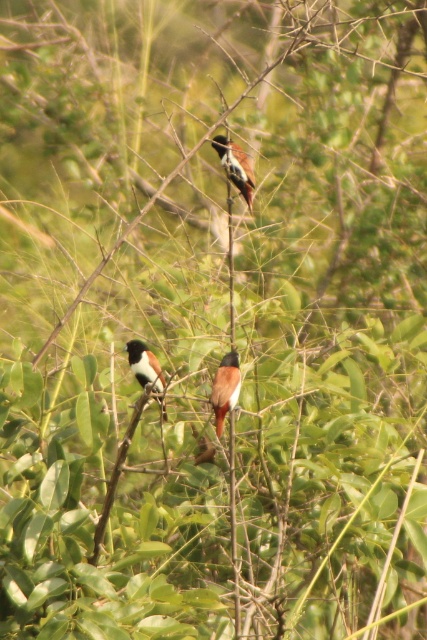
You are observing the birds in the image. There is a brown glossy bird at center and a brown and white feathers at center. Which one is positioned higher?

The brown glossy bird at center is located above the brown and white feathers at center, so it is positioned higher.

You are a birdwatcher trying to capture a photo of the brown matte bird at center and the brown glossy bird at center. Your camera has a maximum focus range of 3 feet. Can you focus on both birds at the same time if they are positioned exactly as shown?

The distance between the brown matte bird at center and the brown glossy bird at center is 3.66 feet. Since the camera can only focus within 3 feet, it cannot capture both birds in focus simultaneously.